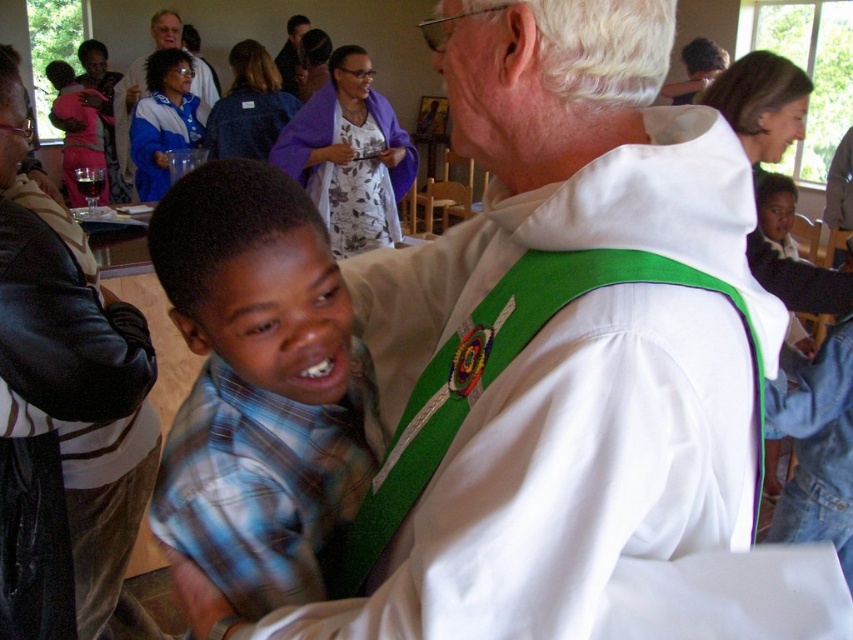
Question: Is blue fabric jacket at upper left in front of smooth brown leather jacket at upper center?

Choices:
 (A) no
 (B) yes

Answer: (B)

Question: Which is nearer to the white matte vest at center?

Choices:
 (A) blue fabric jacket at upper left
 (B) blue fabric robe at upper left
 (C) blue fabric robe at center
 (D) purple fabric robe at upper center

Answer: (D)

Question: Which point is closer to the camera?

Choices:
 (A) blue fabric robe at upper left
 (B) blue fabric robe at center
 (C) purple fabric robe at upper center
 (D) blue plaid shirt at center

Answer: (D)

Question: Is leather jacket at lower left bigger than smooth brown leather jacket at upper center?

Choices:
 (A) yes
 (B) no

Answer: (B)

Question: Which object is positioned closest to the blue fabric jacket at upper left?

Choices:
 (A) blue fabric robe at upper left
 (B) blue fabric robe at center

Answer: (A)

Question: Considering the relative positions of white matte vest at center and leather jacket at lower left in the image provided, where is white matte vest at center located with respect to leather jacket at lower left?

Choices:
 (A) above
 (B) below

Answer: (A)